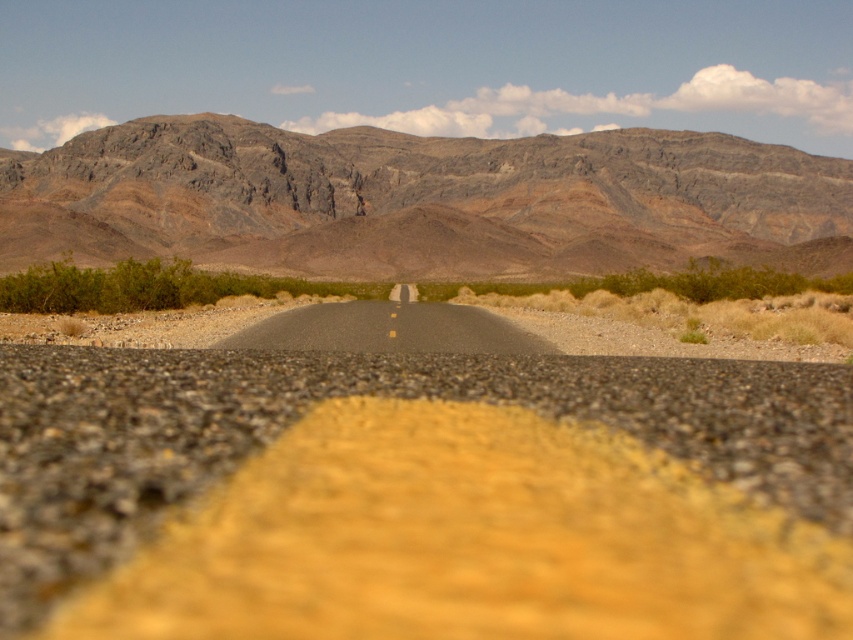
Between smooth asphalt road at center and rugged rock mountain at center, which one is positioned higher?

rugged rock mountain at center is above.

Does smooth asphalt road at center appear under rugged rock mountain at center?

Yes, smooth asphalt road at center is below rugged rock mountain at center.

Describe the element at coordinates (421, 493) in the screenshot. I see `smooth asphalt road at center` at that location.

This screenshot has width=853, height=640. I want to click on smooth asphalt road at center, so click(421, 493).